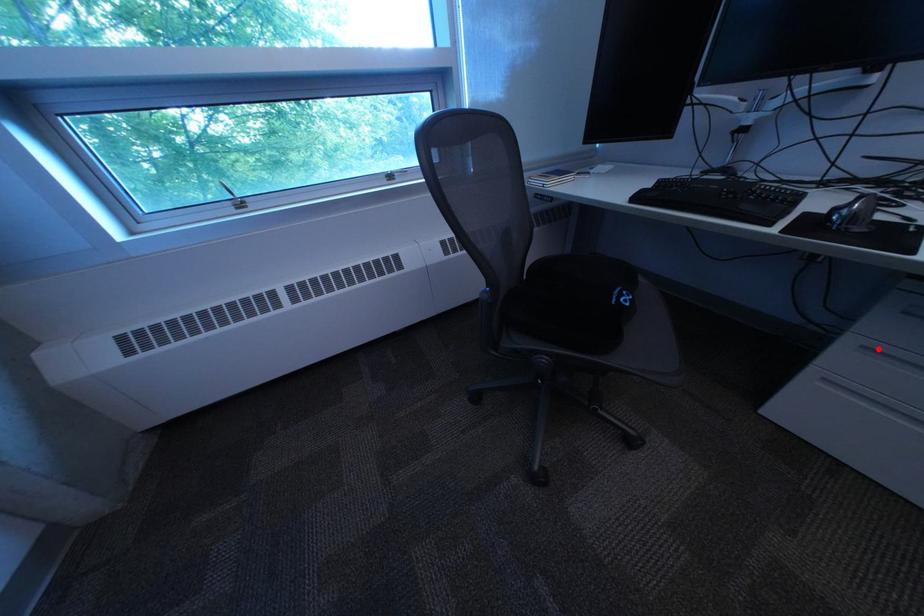
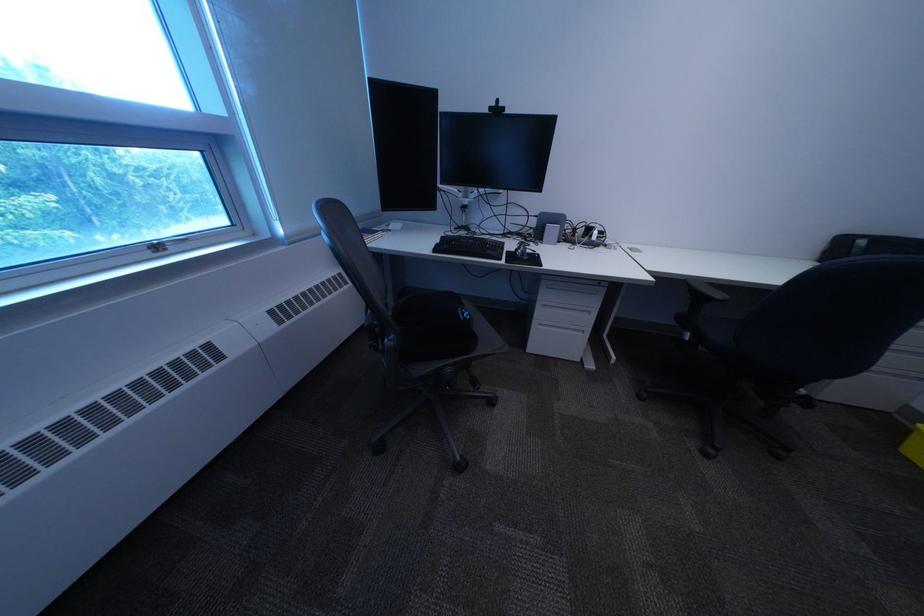
Question: I am providing you with two images of the same scene from different viewpoints. A red point is marked on the first image. Can you still see the location of the red point in image 2?

Choices:
 (A) Yes
 (B) No

Answer: (A)